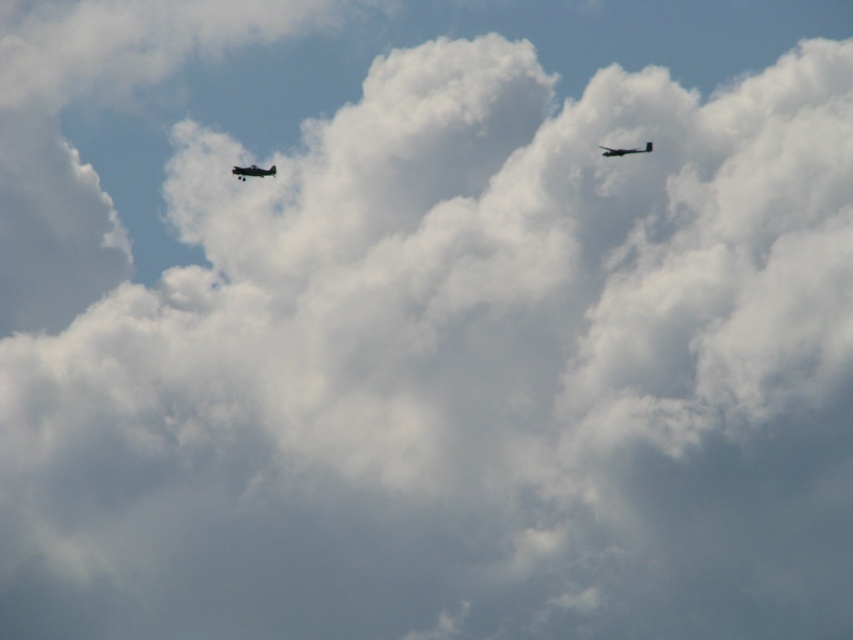
Question: Does shiny silver airplane at upper left have a smaller size compared to metallic gray airplane at upper right?

Choices:
 (A) yes
 (B) no

Answer: (A)

Question: Among these points, which one is nearest to the camera?

Choices:
 (A) (627, 150)
 (B) (250, 172)

Answer: (B)

Question: Considering the relative positions of shiny silver airplane at upper left and metallic gray airplane at upper right in the image provided, where is shiny silver airplane at upper left located with respect to metallic gray airplane at upper right?

Choices:
 (A) below
 (B) above

Answer: (A)

Question: Is shiny silver airplane at upper left wider than metallic gray airplane at upper right?

Choices:
 (A) yes
 (B) no

Answer: (B)